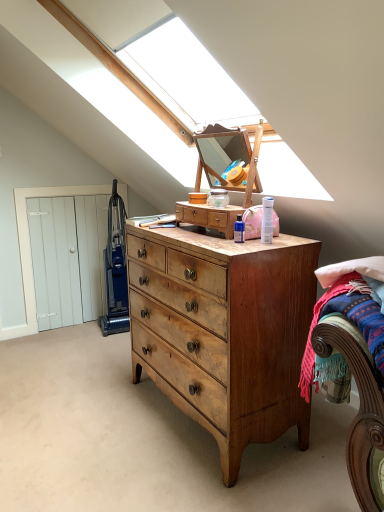
Question: Is light brown wood dresser at center in front of or behind blue plastic vacuum cleaner at left in the image?

Choices:
 (A) behind
 (B) front

Answer: (B)

Question: From the image's perspective, is light brown wood dresser at center above or below blue plastic vacuum cleaner at left?

Choices:
 (A) below
 (B) above

Answer: (B)

Question: Estimate the real-world distances between objects in this image. Which object is closer to the blue plastic vacuum cleaner at left?

Choices:
 (A) light brown wood dresser at center
 (B) light brown wood chest of drawers at center
 (C) wooden bed at lower right

Answer: (B)

Question: Considering the real-world distances, which object is farthest from the wooden bed at lower right?

Choices:
 (A) light brown wood dresser at center
 (B) light brown wood chest of drawers at center
 (C) blue plastic vacuum cleaner at left

Answer: (C)